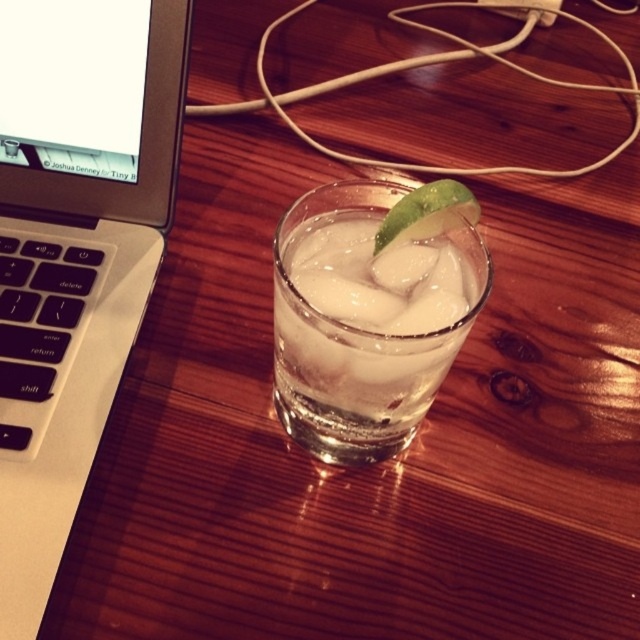
You are organizing items on your desk. You need to place a new pen holder between the silver metallic laptop at left and the clear glass ice at center. Based on their positions, where should you place the pen holder?

The pen holder should be placed below the silver metallic laptop at left since it is located above the clear glass ice at center, creating space between them.

You are a photographer setting up a shot of the desk. The camera is positioned to capture the glass of iced water and the lime slice. If you want to include the silver metallic laptop at left in the frame without moving the camera, will it be fully visible?

The silver metallic laptop at left is 8.51 inches away from the camera, so if the camera is focused on the glass of iced water and lime slice, the laptop may be partially visible depending on the lens and framing, but since it is positioned at the edge of the frame, it might not be fully included without adjusting the camera angle or zoom.

You are organizing items on your desk and want to place a new notebook between the silver metallic laptop at left and the green matte lime at center. Based on their positions, where should you place the notebook?

The notebook should be placed between the silver metallic laptop at left and the green matte lime at center, to the right of the silver metallic laptop at left and to the left of the green matte lime at center since the silver metallic laptop at left is positioned to the left of the green matte lime at center.